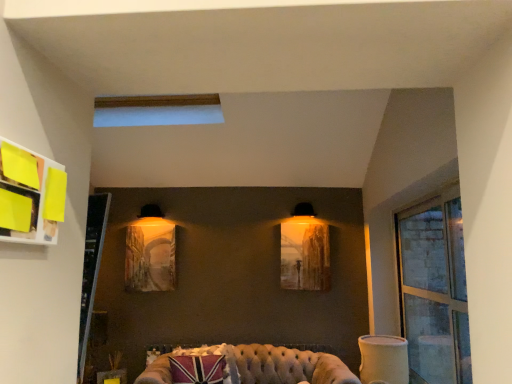
Question: From the image's perspective, relative to matte glass picture frame at center, which appears as the 2th picture frame when viewed from the left, is yellow paper at upper left above or below?

Choices:
 (A) above
 (B) below

Answer: (A)

Question: Is yellow paper at upper left taller or shorter than matte glass picture frame at center, which appears as the 2th picture frame when viewed from the left?

Choices:
 (A) tall
 (B) short

Answer: (B)

Question: Estimate the real-world distances between objects in this image. Which object is farther from the matte wooden picture frame at center, which is the first picture frame in left-to-right order?

Choices:
 (A) tufted leather couch at lower center
 (B) yellow paper at upper left
 (C) transparent glass window at right
 (D) matte glass picture frame at center, which appears as the 2th picture frame when viewed from the left

Answer: (B)

Question: Estimate the real-world distances between objects in this image. Which object is farther from the tufted leather couch at lower center?

Choices:
 (A) matte wooden picture frame at center, the 2th picture frame viewed from the right
 (B) transparent glass window at right
 (C) yellow paper at upper left
 (D) matte glass picture frame at center, the first picture frame positioned from the right

Answer: (C)